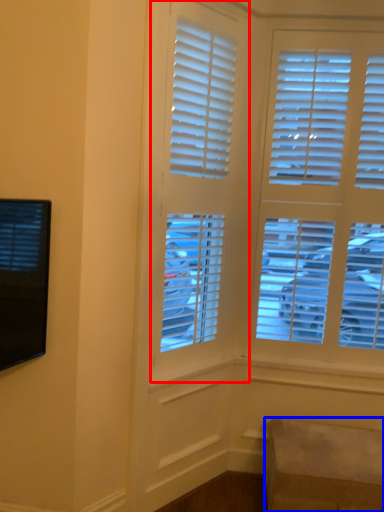
Question: Which object is further to the camera taking this photo, window (highlighted by a red box) or furniture (highlighted by a blue box)?

Choices:
 (A) window
 (B) furniture

Answer: (B)